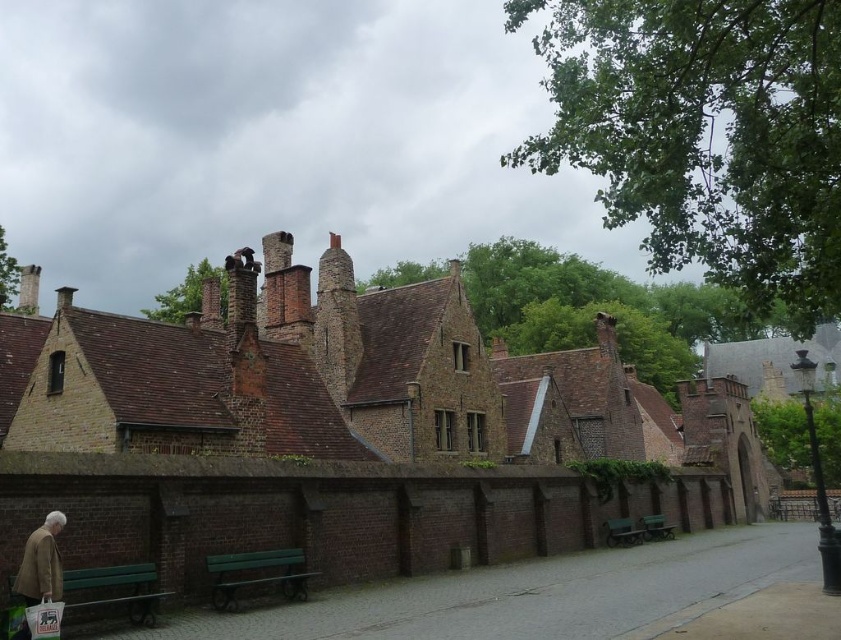
You are a visitor exploring the historical area and want to sit on one of the green wooden benches. If you walk towards the green wooden bench at lower center and the green wooden bench at center, which one will you encounter first?

The green wooden bench at lower center is located above the green wooden bench at center, so you will encounter the green wooden bench at lower center first as you approach them from the front.

You are standing in front of the brick buildings and see two green wooden benches. Which one is nearer to you, the green wooden bench at lower left or the green wooden bench at center?

The green wooden bench at lower left is closer to the viewer than the green wooden bench at center.